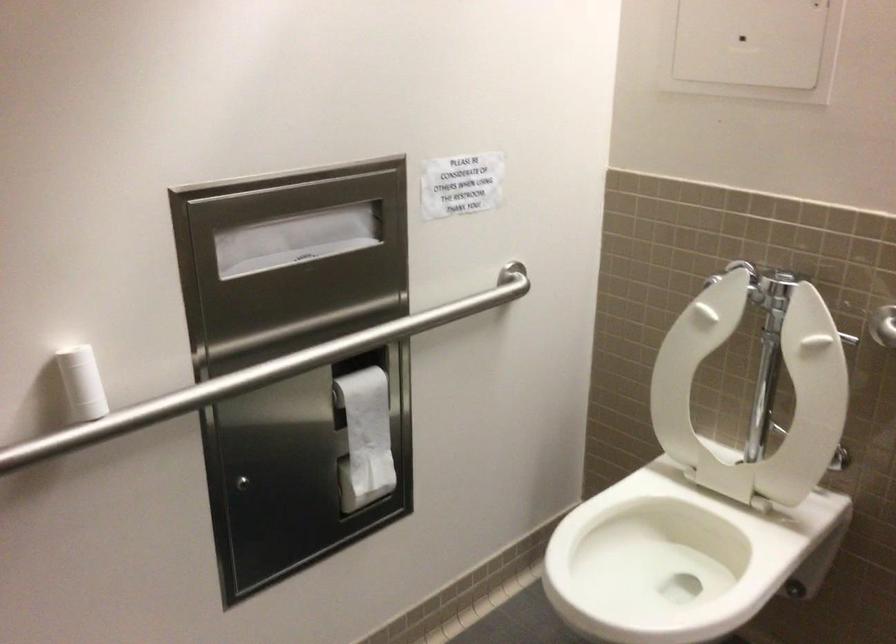
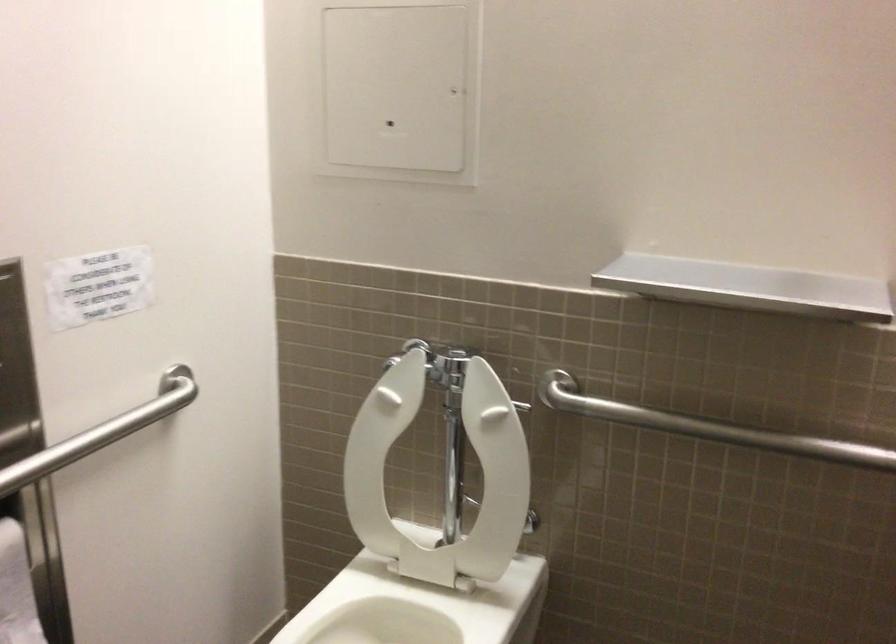
In the second image, find the point that corresponds to pixel 446 308 in the first image.

(102, 431)